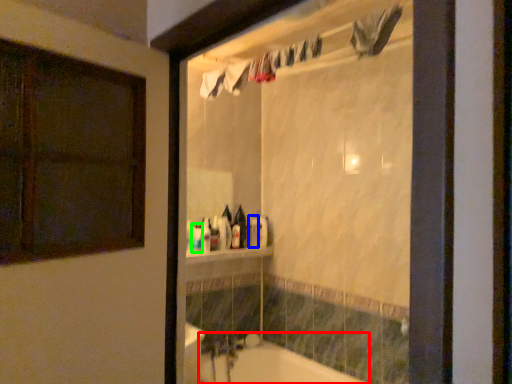
Question: Based on their relative distances, which object is farther from bathtub (highlighted by a red box)? Choose from toiletry (highlighted by a blue box) and toiletry (highlighted by a green box).

Choices:
 (A) toiletry
 (B) toiletry

Answer: (B)